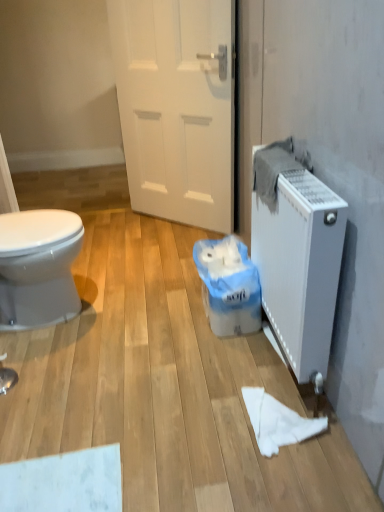
Locate an element on the screen. This screenshot has width=384, height=512. free space that is in between white matte radiator at right and white paper towel at lower center is located at coordinates (254, 368).